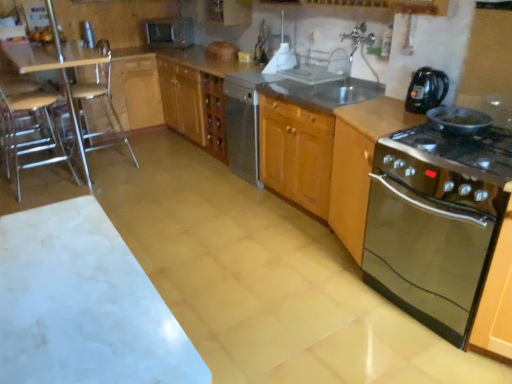
I want to click on vacant space that is in between black stainless steel oven at right, marked as the 1th cabinetry in a front-to-back arrangement, and clear acrylic table at left, which ranks as the second table in bottom-to-top order, so click(217, 226).